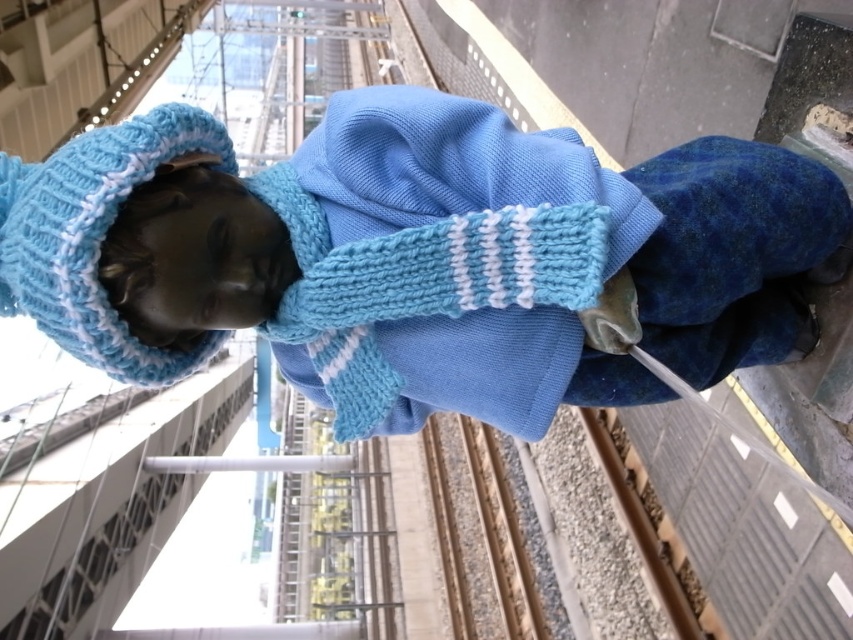
Looking at this image, you are a photographer standing at the statue and want to take a photo that includes both point [108,163] and point [627,506]. Considering their positions, which point will appear larger in the photo?

Point [108,163] is closer to the viewer than point [627,506], so it will appear larger in the photo.

You are a photographer standing at the platform. You want to take a photo of the knitted blue sweater at center and the brown gravel train track at lower center so that both are visible in the frame. Based on their positions, which object should you position closer to the left side of your camera viewfinder?

The knitted blue sweater at center is to the left of the brown gravel train track at lower center, so you should position the knitted blue sweater at center closer to the left side of your camera viewfinder to include both in the frame.

You are a photographer standing at the railway platform. You want to position your camera such that the knitted blue sweater at center is perfectly framed. Given that the sweater is located at coordinates 0.403 on the x and 0.489 on the y axis, where should you aim your camera to capture the sweater in the center of your shot?

To capture the knitted blue sweater at center in the center of your shot, aim your camera at the coordinates 0.403 on the x axis and 0.489 on the y axis, as this is the exact 2D location of the sweater.